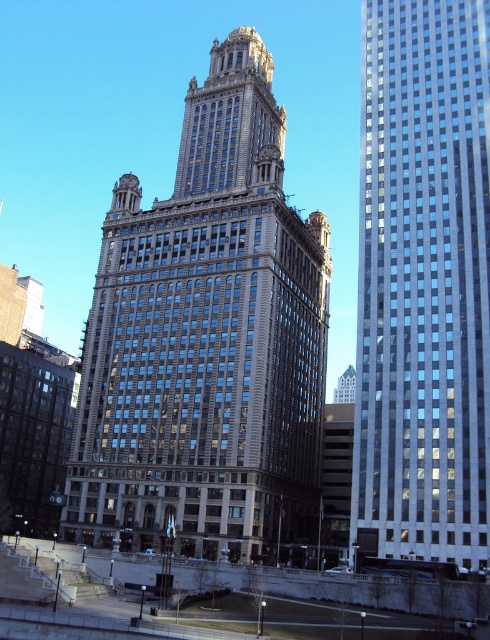
Is point (199, 508) positioned after point (430, 416)?

Yes, it is behind point (430, 416).

Consider the image. How far apart are brown stone building at center and glassy reflective skyscraper at right?

brown stone building at center is 16.99 meters from glassy reflective skyscraper at right.

At what (x,y) coordinates should I click in order to perform the action: click on brown stone building at center. Please return your answer as a coordinate pair (x, y). Looking at the image, I should click on (206, 342).